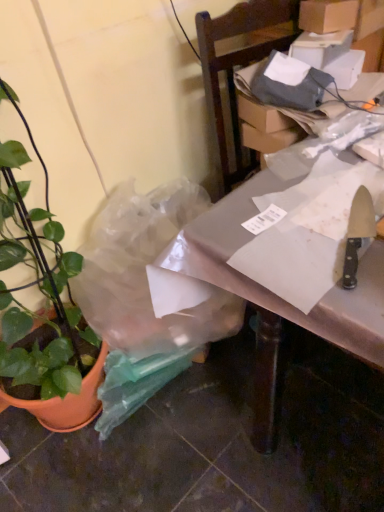
Question: Is cardboard box at upper right not close to green matte plant pot at left?

Choices:
 (A) no
 (B) yes

Answer: (B)

Question: Does cardboard box at upper right have a greater height compared to green matte plant pot at left?

Choices:
 (A) no
 (B) yes

Answer: (A)

Question: From the image's perspective, is cardboard box at upper right on top of green matte plant pot at left?

Choices:
 (A) no
 (B) yes

Answer: (B)

Question: Does cardboard box at upper right turn towards green matte plant pot at left?

Choices:
 (A) yes
 (B) no

Answer: (B)

Question: Considering the relative sizes of cardboard box at upper right and green matte plant pot at left in the image provided, is cardboard box at upper right smaller than green matte plant pot at left?

Choices:
 (A) no
 (B) yes

Answer: (B)

Question: Looking at the image, does metallic silver table at center seem bigger or smaller compared to green matte plant pot at left?

Choices:
 (A) big
 (B) small

Answer: (A)

Question: Is point (263, 401) positioned closer to the camera than point (9, 331)?

Choices:
 (A) farther
 (B) closer

Answer: (B)

Question: Considering the relative positions of metallic silver table at center and green matte plant pot at left in the image provided, is metallic silver table at center to the left or to the right of green matte plant pot at left?

Choices:
 (A) right
 (B) left

Answer: (A)

Question: Which is correct: metallic silver table at center is inside green matte plant pot at left, or outside of it?

Choices:
 (A) outside
 (B) inside

Answer: (A)

Question: Considering their positions, is metallic silver table at center located in front of or behind cardboard box at upper right?

Choices:
 (A) front
 (B) behind

Answer: (A)

Question: From the image's perspective, is metallic silver table at center above or below cardboard box at upper right?

Choices:
 (A) below
 (B) above

Answer: (A)

Question: Looking at the image, does metallic silver table at center seem bigger or smaller compared to cardboard box at upper right?

Choices:
 (A) small
 (B) big

Answer: (B)

Question: Considering the positions of metallic silver table at center and cardboard box at upper right in the image, is metallic silver table at center wider or thinner than cardboard box at upper right?

Choices:
 (A) wide
 (B) thin

Answer: (A)

Question: Looking at their shapes, would you say green matte plant pot at left is wider or thinner than white paper at right?

Choices:
 (A) wide
 (B) thin

Answer: (B)

Question: Based on their positions, is green matte plant pot at left located to the left or right of white paper at right?

Choices:
 (A) right
 (B) left

Answer: (B)